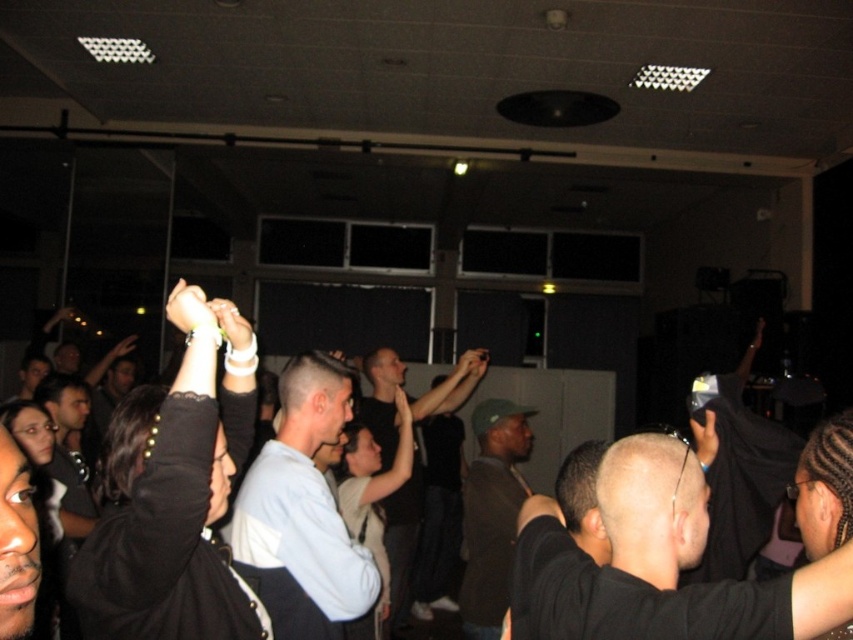
Question: In this image, where is black matte shirt at center located relative to light blue shirt at center?

Choices:
 (A) below
 (B) above

Answer: (B)

Question: Which object appears farthest from the camera in this image?

Choices:
 (A) black matte shirt at center
 (B) green matte cap at center

Answer: (B)

Question: Estimate the real-world distances between objects in this image. Which object is closer to the black matte jacket at center?

Choices:
 (A) white matte shirt at center
 (B) light blue shirt at center

Answer: (A)

Question: Which point appears farthest from the camera in this image?

Choices:
 (A) click(280, 472)
 (B) click(198, 602)
 (C) click(440, 529)

Answer: (C)

Question: Does black matte shirt at center appear on the right side of white matte shirt at center?

Choices:
 (A) yes
 (B) no

Answer: (A)

Question: Does black matte jacket at center come in front of light blue shirt at center?

Choices:
 (A) no
 (B) yes

Answer: (B)